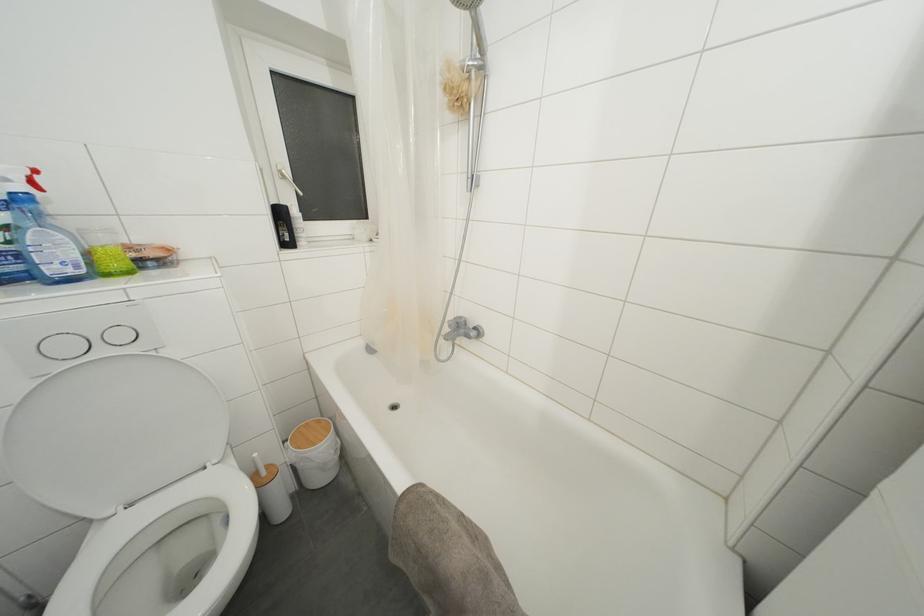
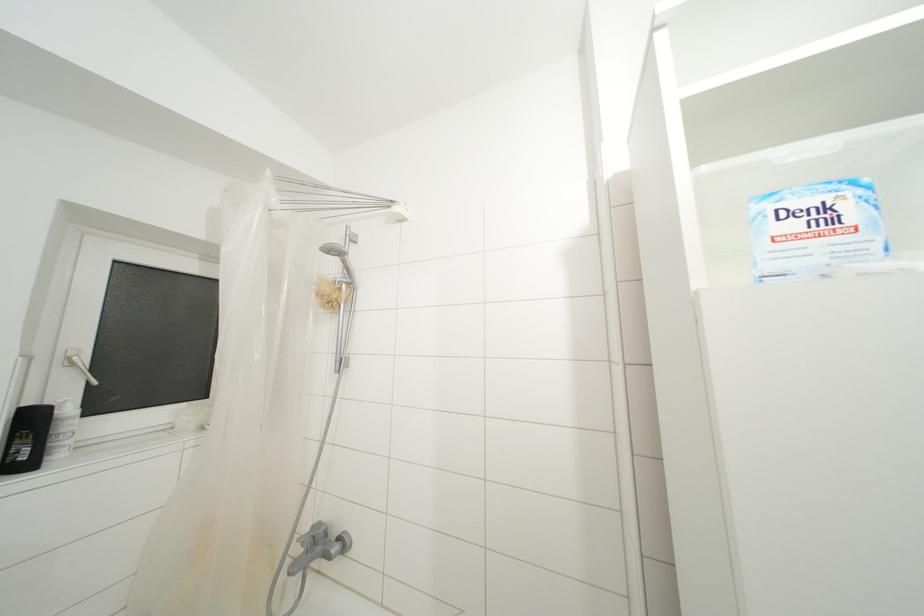
From the picture: The images are taken continuously from a first-person perspective. In which direction is your viewpoint rotating?

The camera's rotation is toward right-up.